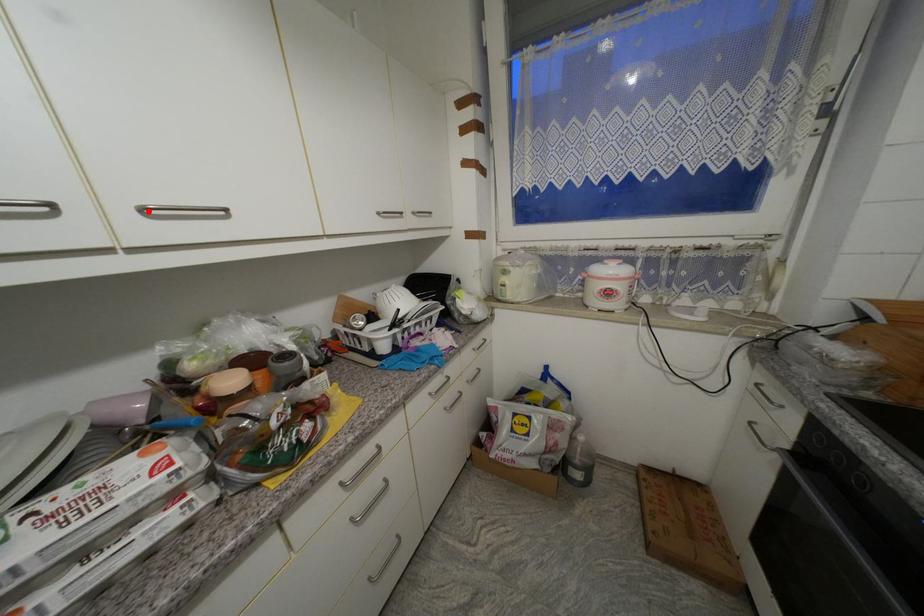
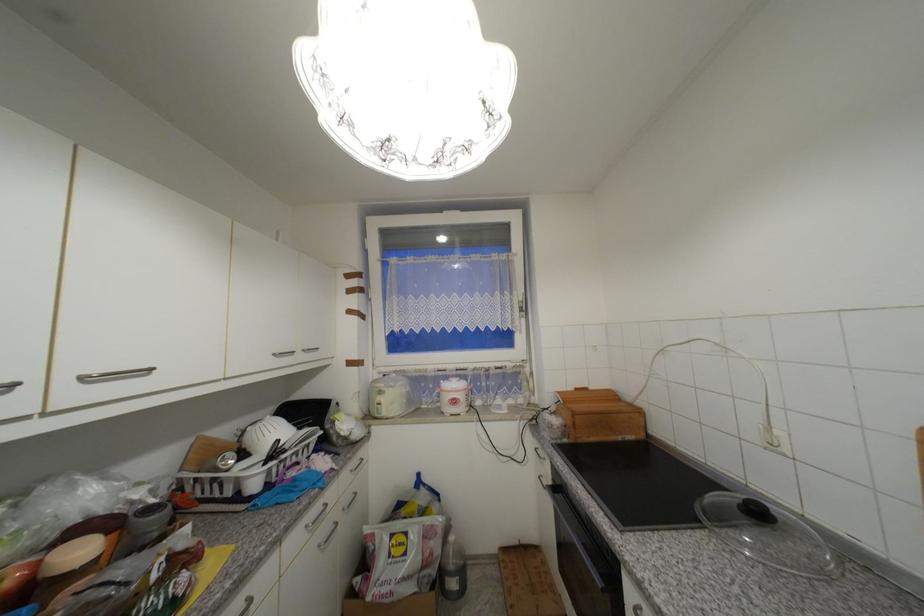
Locate, in the second image, the point that corresponds to the highlighted location in the first image.

(89, 379)